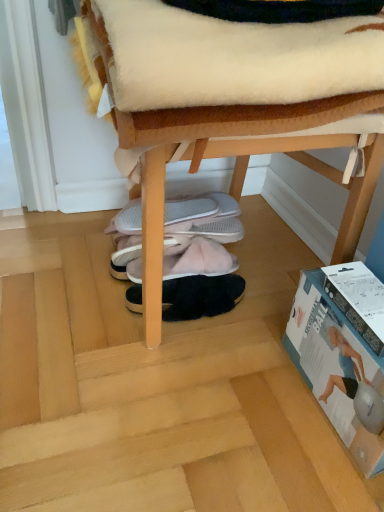
Question: Is white cardboard box at lower right in front of pink fuzzy slippers at center, which ranks as the second footwear in top-to-bottom order?

Choices:
 (A) no
 (B) yes

Answer: (B)

Question: From the image's perspective, is white cardboard box at lower right beneath pink fuzzy slippers at center, the second footwear ordered from the bottom?

Choices:
 (A) yes
 (B) no

Answer: (A)

Question: From a real-world perspective, does white cardboard box at lower right sit lower than pink fuzzy slippers at center, the second footwear ordered from the bottom?

Choices:
 (A) yes
 (B) no

Answer: (B)

Question: From the image's perspective, is white cardboard box at lower right on pink fuzzy slippers at center, the second footwear ordered from the bottom?

Choices:
 (A) yes
 (B) no

Answer: (B)

Question: Can pink fuzzy slippers at center, the second footwear ordered from the bottom, be found inside white cardboard box at lower right?

Choices:
 (A) no
 (B) yes

Answer: (A)

Question: Does white cardboard box at lower right have a larger size compared to pink fuzzy slippers at center, the second footwear ordered from the bottom?

Choices:
 (A) no
 (B) yes

Answer: (B)

Question: Is white cardboard box at lower right closer to camera compared to wooden chair at center?

Choices:
 (A) yes
 (B) no

Answer: (B)

Question: Does white cardboard box at lower right appear on the right side of wooden chair at center?

Choices:
 (A) yes
 (B) no

Answer: (A)

Question: Can you confirm if white cardboard box at lower right is bigger than wooden chair at center?

Choices:
 (A) yes
 (B) no

Answer: (B)

Question: Could you tell me if white cardboard box at lower right is facing wooden chair at center?

Choices:
 (A) no
 (B) yes

Answer: (A)

Question: Does white cardboard box at lower right have a lesser height compared to wooden chair at center?

Choices:
 (A) no
 (B) yes

Answer: (B)

Question: Is white cardboard box at lower right oriented away from wooden chair at center?

Choices:
 (A) yes
 (B) no

Answer: (B)

Question: From the image's perspective, is black fuzzy slippers at center, which appears as the third footwear when viewed from the top, below wooden chair at center?

Choices:
 (A) no
 (B) yes

Answer: (B)